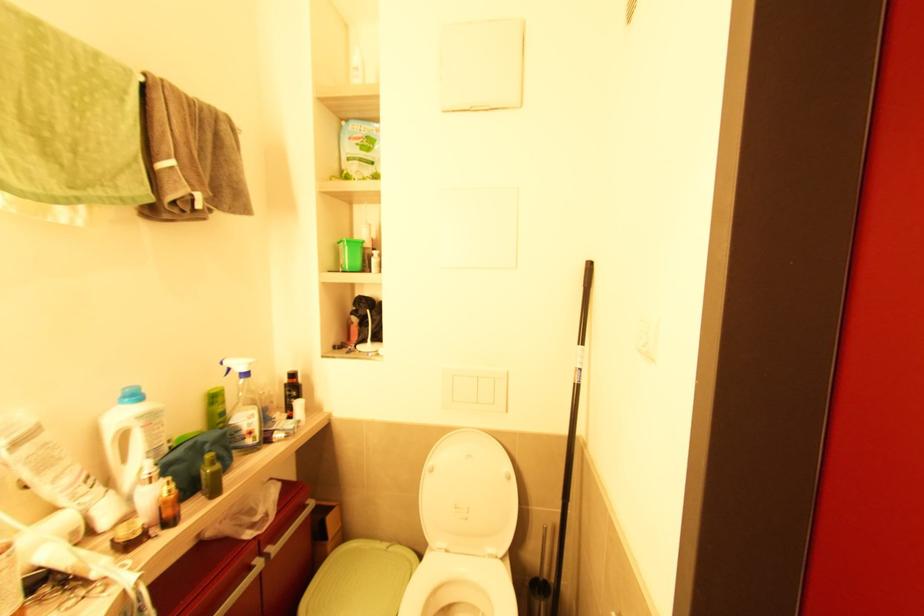
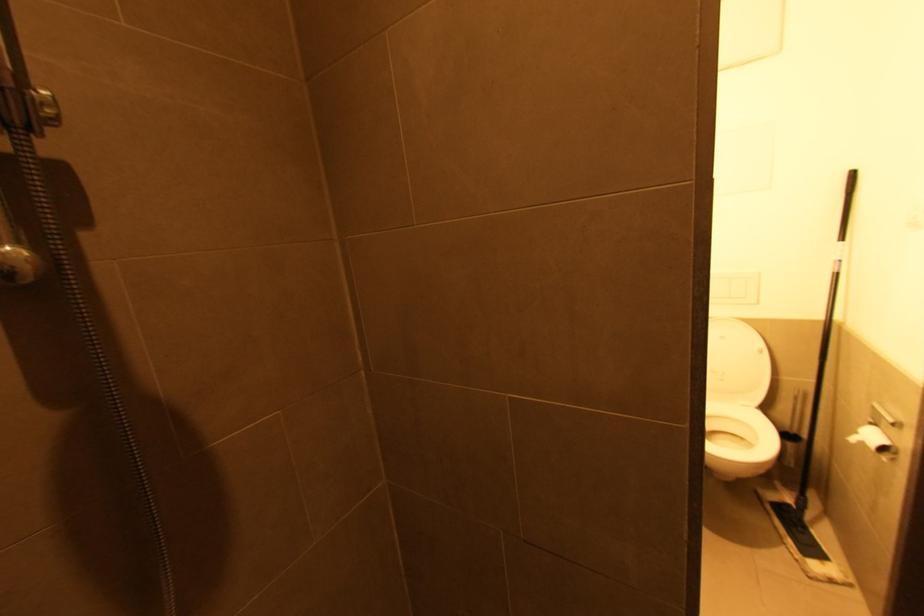
Based on the photo, the images are taken continuously from a first-person perspective. In which direction are you moving?

The cameraman moved toward left, backward.